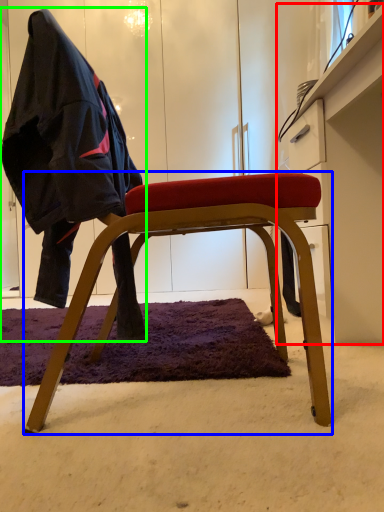
Question: Which object is positioned farthest from dresser (highlighted by a red box)? Select from chair (highlighted by a blue box) and person (highlighted by a green box).

Choices:
 (A) chair
 (B) person

Answer: (B)